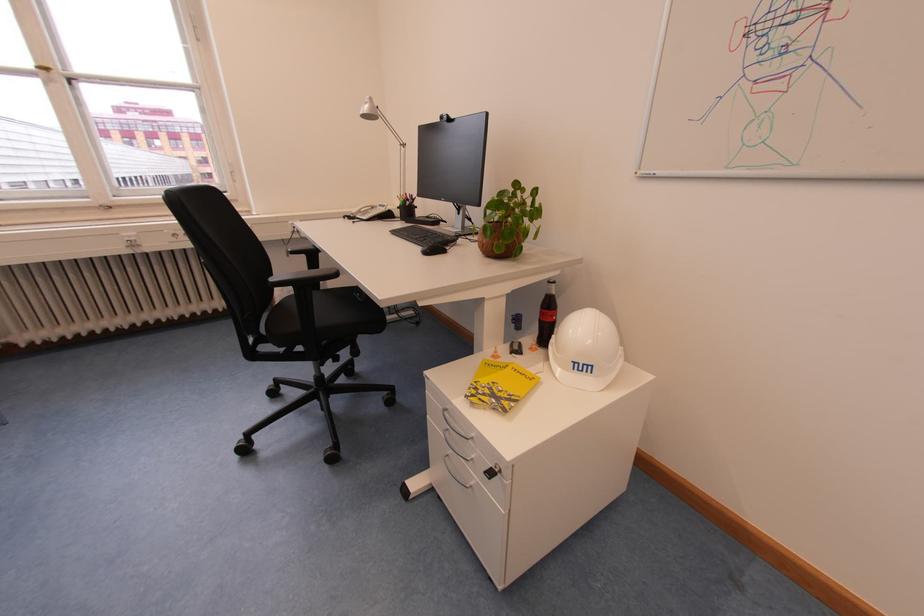
Describe the element at coordinates (129, 240) in the screenshot. The height and width of the screenshot is (616, 924). I see `the radiator control knob` at that location.